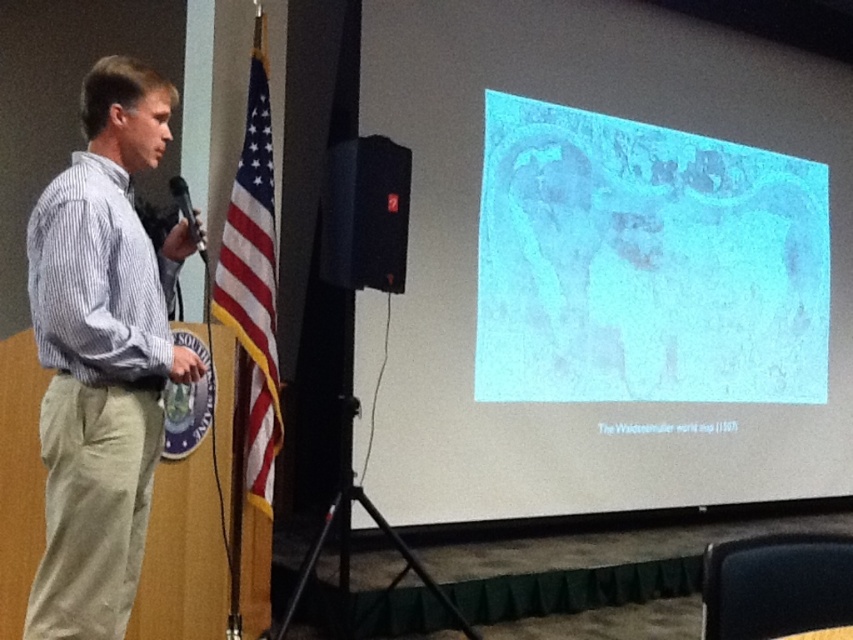
Question: Is white striped shirt at left in front of american flag at left?

Choices:
 (A) no
 (B) yes

Answer: (B)

Question: In this image, where is striped cotton shirt at left located relative to american flag at left?

Choices:
 (A) above
 (B) below

Answer: (B)

Question: Based on their relative distances, which object is nearer to the american flag at left?

Choices:
 (A) white striped shirt at left
 (B) blue translucent map at upper right
 (C) black matte speaker at center

Answer: (C)

Question: Observing the image, what is the correct spatial positioning of striped cotton shirt at left in reference to black matte speaker at center?

Choices:
 (A) right
 (B) left

Answer: (B)

Question: Which point is closer to the camera?

Choices:
 (A) striped cotton shirt at left
 (B) blue translucent map at upper right
 (C) white striped shirt at left
 (D) american flag at left

Answer: (A)

Question: Considering the real-world distances, which object is closest to the striped cotton shirt at left?

Choices:
 (A) white striped shirt at left
 (B) black matte speaker at center
 (C) american flag at left
 (D) blue translucent map at upper right

Answer: (A)